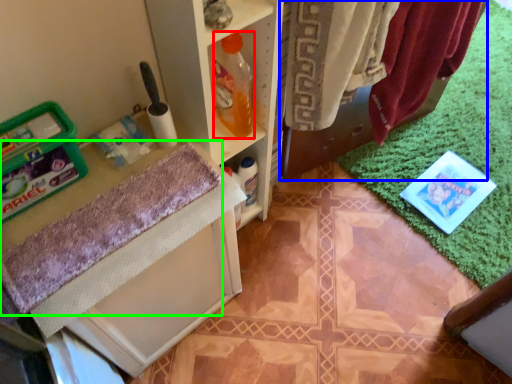
Question: Which object is the farthest from bottle (highlighted by a red box)? Choose among these: laundry (highlighted by a blue box) or bath towel (highlighted by a green box).

Choices:
 (A) laundry
 (B) bath towel

Answer: (A)